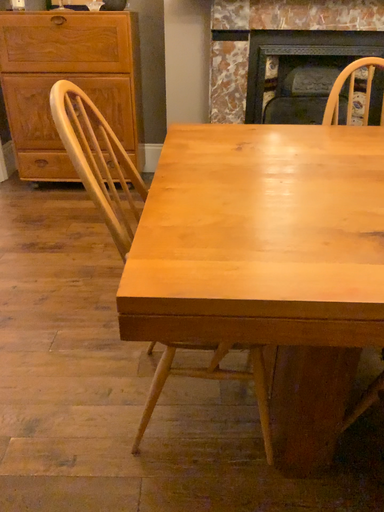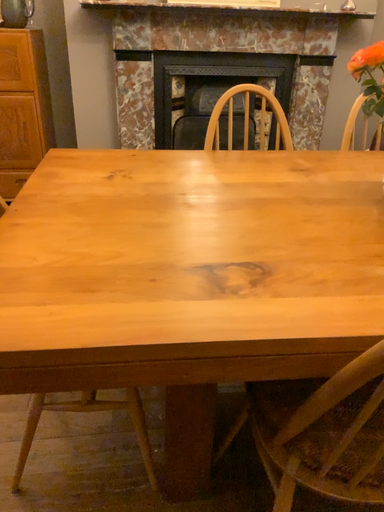
Question: Which way did the camera rotate in the video?

Choices:
 (A) rotated right
 (B) rotated left

Answer: (A)